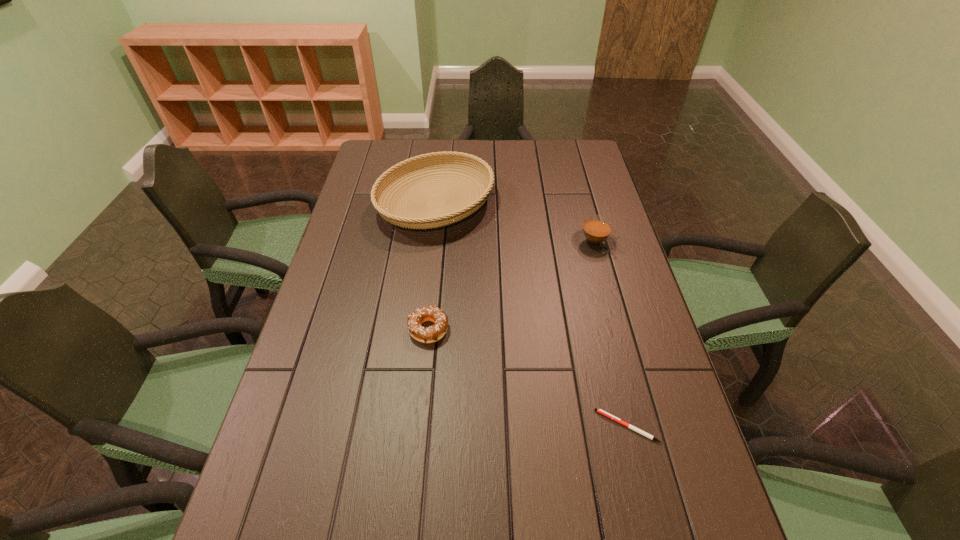
Find the location of a particular element. This screenshot has width=960, height=540. object that is the nearest to the third shortest object is located at coordinates (421, 219).

Identify which object is the nearest to the cappuccino. Please provide its 2D coordinates. Your answer should be formatted as a tuple, i.e. [(x, y)], where the tuple contains the x and y coordinates of a point satisfying the conditions above.

[(421, 219)]

What are the coordinates of `vacant space that satisfies the following two spatial constraints: 1. on the front side of the cappuccino; 2. on the clicker of the pen` in the screenshot? It's located at (643, 426).

Find the location of a particular element. This screenshot has height=540, width=960. vacant space that satisfies the following two spatial constraints: 1. on the front side of the third tallest object; 2. on the left side of the basket is located at coordinates (421, 329).